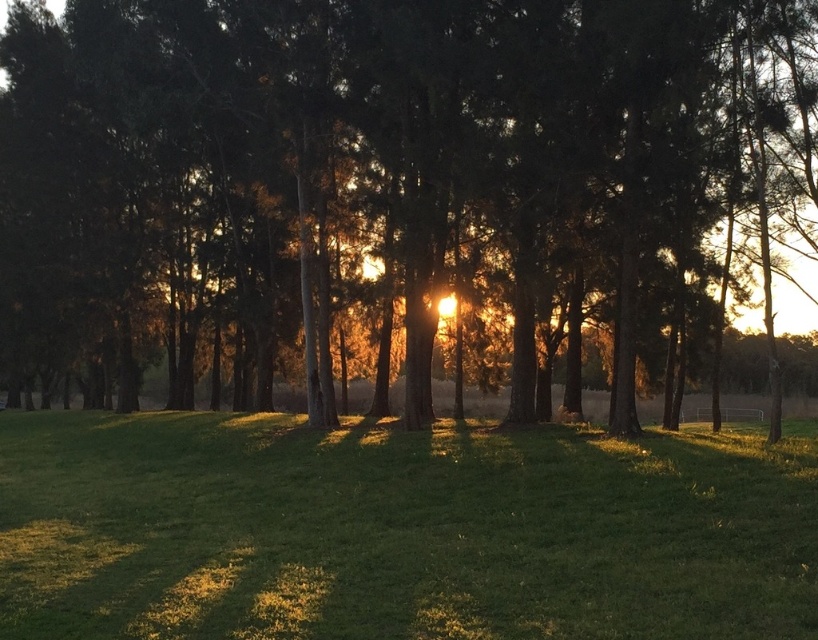
Question: Which point is closer to the camera?

Choices:
 (A) (463, 598)
 (B) (365, 225)

Answer: (A)

Question: Is green matte tree at center thinner than green grassy field at center?

Choices:
 (A) no
 (B) yes

Answer: (A)

Question: Can you confirm if green matte tree at center is positioned below green grassy field at center?

Choices:
 (A) no
 (B) yes

Answer: (A)

Question: Which point is closer to the camera taking this photo?

Choices:
 (A) (375, 614)
 (B) (163, 237)

Answer: (A)

Question: Does green matte tree at center have a smaller size compared to green grassy field at center?

Choices:
 (A) yes
 (B) no

Answer: (B)